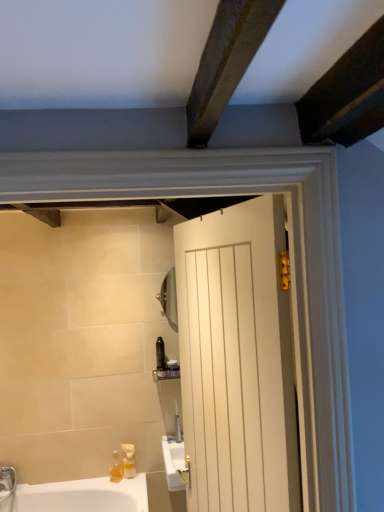
Question: Can you confirm if translucent yellow plastic at lower left, positioned as the 2th soap dispenser in left-to-right order, is shorter than translucent plastic bottle at center, positioned as the second toiletry in right-to-left order?

Choices:
 (A) yes
 (B) no

Answer: (A)

Question: From a real-world perspective, is translucent yellow plastic at lower left, placed as the 1th soap dispenser when sorted from right to left, located beneath translucent plastic bottle at center, the 1th toiletry positioned from the left?

Choices:
 (A) no
 (B) yes

Answer: (B)

Question: Is translucent yellow plastic at lower left, positioned as the 2th soap dispenser in left-to-right order, positioned behind translucent plastic bottle at center, positioned as the second toiletry in right-to-left order?

Choices:
 (A) no
 (B) yes

Answer: (A)

Question: Does translucent yellow plastic at lower left, placed as the 1th soap dispenser when sorted from right to left, have a smaller size compared to translucent plastic bottle at center, positioned as the second toiletry in right-to-left order?

Choices:
 (A) yes
 (B) no

Answer: (B)

Question: Could you tell me if translucent yellow plastic at lower left, positioned as the 2th soap dispenser in left-to-right order, is turned towards translucent plastic bottle at center, the 1th toiletry positioned from the left?

Choices:
 (A) yes
 (B) no

Answer: (B)

Question: Is translucent yellow plastic at lower left, placed as the 1th soap dispenser when sorted from right to left, bigger or smaller than translucent plastic bottle at center, positioned as the second toiletry in right-to-left order?

Choices:
 (A) big
 (B) small

Answer: (A)

Question: Considering the positions of translucent yellow plastic at lower left, positioned as the 2th soap dispenser in left-to-right order, and translucent plastic bottle at center, positioned as the second toiletry in right-to-left order, in the image, is translucent yellow plastic at lower left, positioned as the 2th soap dispenser in left-to-right order, wider or thinner than translucent plastic bottle at center, positioned as the second toiletry in right-to-left order,?

Choices:
 (A) thin
 (B) wide

Answer: (A)

Question: In terms of height, does translucent yellow plastic at lower left, positioned as the 2th soap dispenser in left-to-right order, look taller or shorter compared to translucent plastic bottle at center, the 1th toiletry positioned from the left?

Choices:
 (A) tall
 (B) short

Answer: (B)

Question: Is point (127, 452) closer or farther from the camera than point (158, 357)?

Choices:
 (A) closer
 (B) farther

Answer: (A)

Question: Is white wooden door at center wider or thinner than translucent yellow plastic at lower left, positioned as the 2th soap dispenser in left-to-right order?

Choices:
 (A) thin
 (B) wide

Answer: (B)

Question: Looking at the image, does white wooden door at center seem bigger or smaller compared to translucent yellow plastic at lower left, placed as the 1th soap dispenser when sorted from right to left?

Choices:
 (A) small
 (B) big

Answer: (B)

Question: Do you think white wooden door at center is within translucent yellow plastic at lower left, placed as the 1th soap dispenser when sorted from right to left, or outside of it?

Choices:
 (A) inside
 (B) outside

Answer: (B)

Question: Is point [223, 374] positioned closer to the camera than point [129, 466]?

Choices:
 (A) farther
 (B) closer

Answer: (B)

Question: Considering the positions of translucent yellow plastic at lower left, placed as the 1th soap dispenser when sorted from right to left, and translucent plastic soap dispenser at lower left, acting as the 1th soap dispenser starting from the left, in the image, is translucent yellow plastic at lower left, placed as the 1th soap dispenser when sorted from right to left, wider or thinner than translucent plastic soap dispenser at lower left, acting as the 1th soap dispenser starting from the left,?

Choices:
 (A) thin
 (B) wide

Answer: (B)

Question: From the image's perspective, is translucent yellow plastic at lower left, placed as the 1th soap dispenser when sorted from right to left, located above or below translucent plastic soap dispenser at lower left, acting as the 1th soap dispenser starting from the left?

Choices:
 (A) above
 (B) below

Answer: (A)